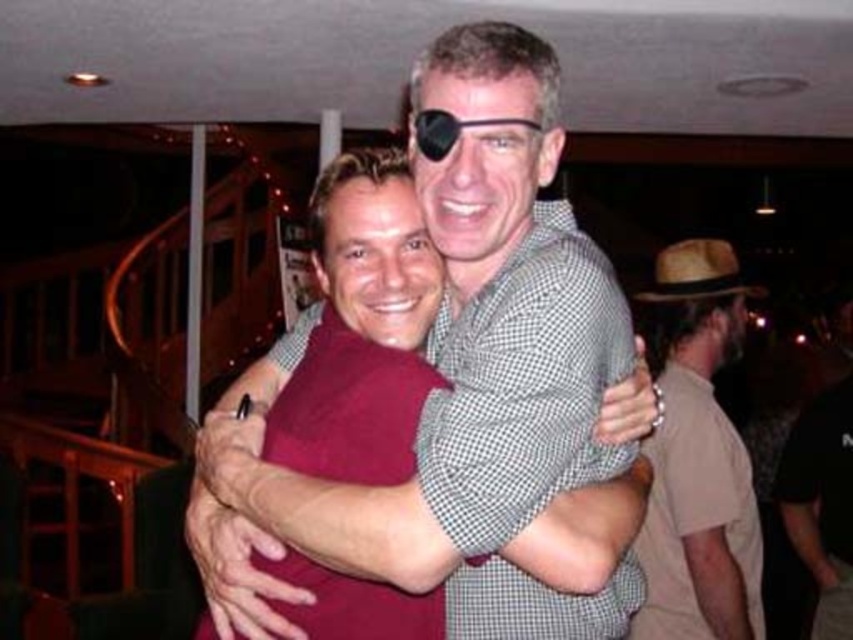
You are at a party and want to choose a hat to wear. You see the brown straw hat at right and the brown straw cowboy hat at right. Which hat is bigger?

The brown straw hat at right is larger in size compared to the brown straw cowboy hat at right.

You are at the entrance of the venue and want to find the person wearing the maroon shirt at center. According to the coordinates provided, in which direction should you move from your current position to locate them?

The maroon shirt at center is located at coordinates point (460, 378). Since the x and y values are both above 0.5, this means the maroon shirt at center is positioned towards the right and upper half of the image. Therefore, you should move towards the right and upward direction from your current position at the entrance to locate them.

You are standing at a point in a bar and want to reach the staircase. The point you are currently at is marked as point (669, 588). Given that the distance from this point to the staircase is 2.31 meters, can you estimate how far you need to walk to reach the staircase?

The distance between point (669, 588) and the staircase is 2.31 meters, so you need to walk approximately 2.31 meters to reach the staircase.